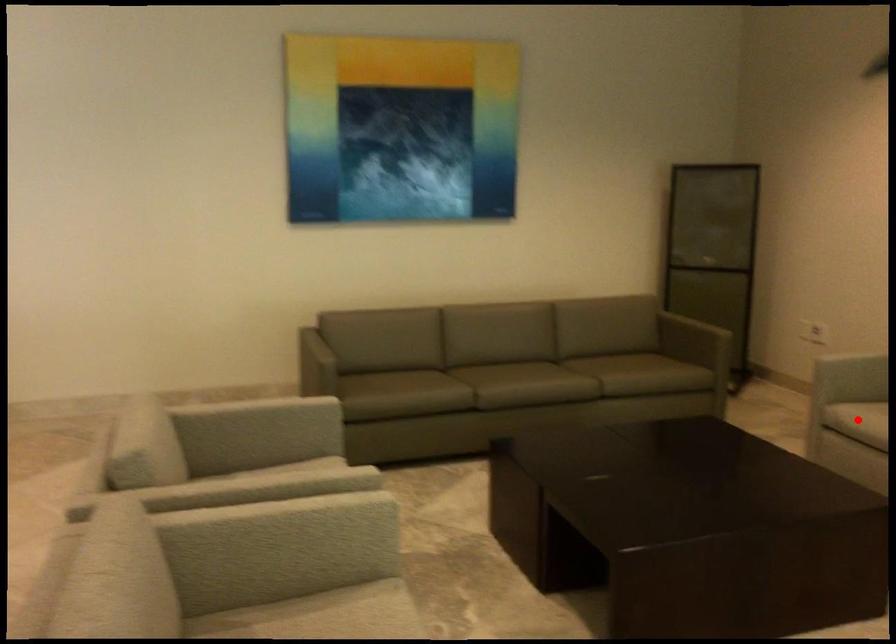
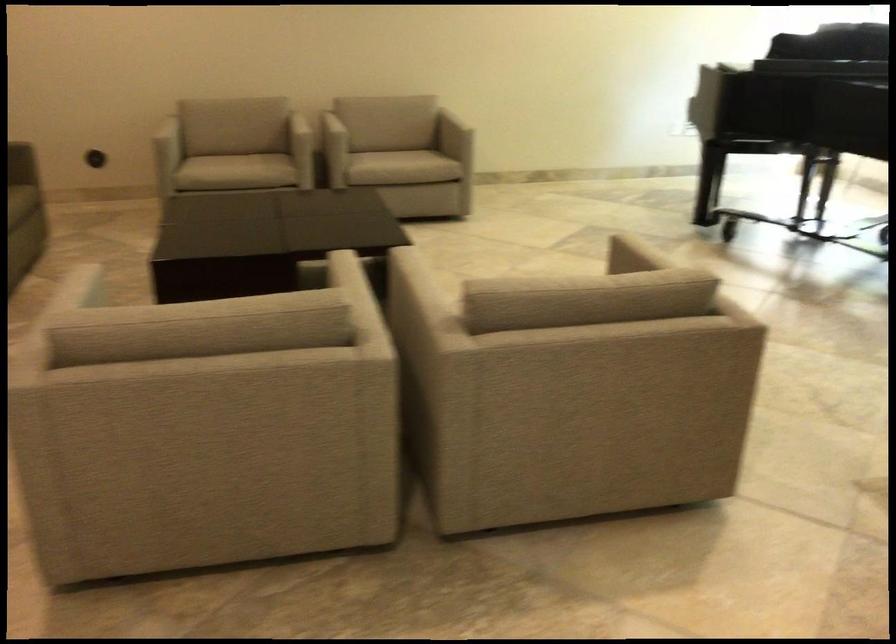
Question: I am providing you with two images of the same scene from different viewpoints. Given a red point in image1, look at the same physical point in image2. Is it:

Choices:
 (A) Closer to the viewpoint
 (B) Farther from the viewpoint

Answer: (B)